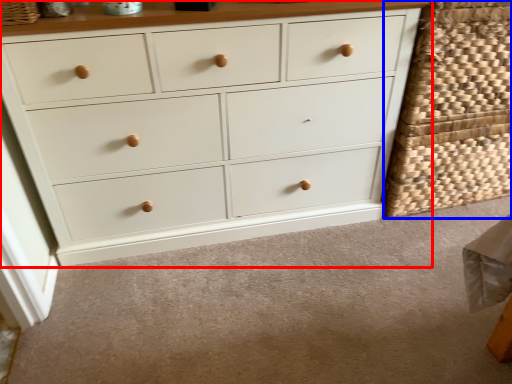
Question: Which point is closer to the camera, chest of drawers (highlighted by a red box) or basket (highlighted by a blue box)?

Choices:
 (A) chest of drawers
 (B) basket

Answer: (A)